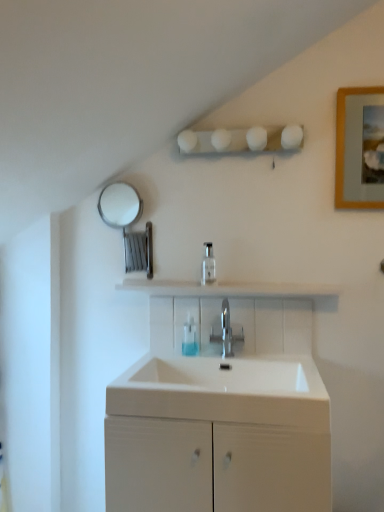
Question: Looking at the image, does white glossy shelf at center seem bigger or smaller compared to white glossy sink at center?

Choices:
 (A) big
 (B) small

Answer: (B)

Question: From a real-world perspective, is white glossy shelf at center above or below white glossy sink at center?

Choices:
 (A) above
 (B) below

Answer: (A)

Question: Which object is the closest to the wooden picture frame at upper right?

Choices:
 (A) white glossy soap dispenser at center
 (B) white matte cabinet at center
 (C) white glossy shelf at center
 (D) white glossy sink at center
 (E) translucent plastic soap dispenser at center

Answer: (C)

Question: Estimate the real-world distances between objects in this image. Which object is farther from the white matte cabinet at center?

Choices:
 (A) wooden picture frame at upper right
 (B) white glossy sink at center
 (C) white glossy shelf at center
 (D) white matte light fixture at upper center
 (E) polished metallic tap at center

Answer: (D)